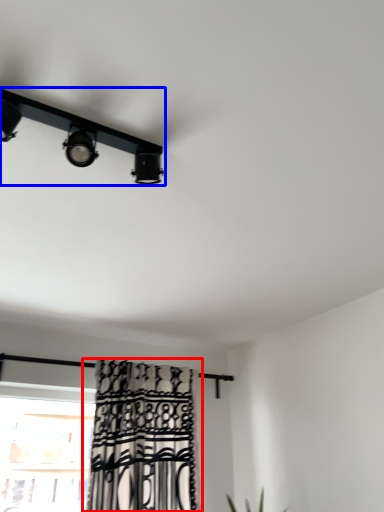
Question: Which of the following is the farthest to the observer, curtain (highlighted by a red box) or lamp (highlighted by a blue box)?

Choices:
 (A) curtain
 (B) lamp

Answer: (A)